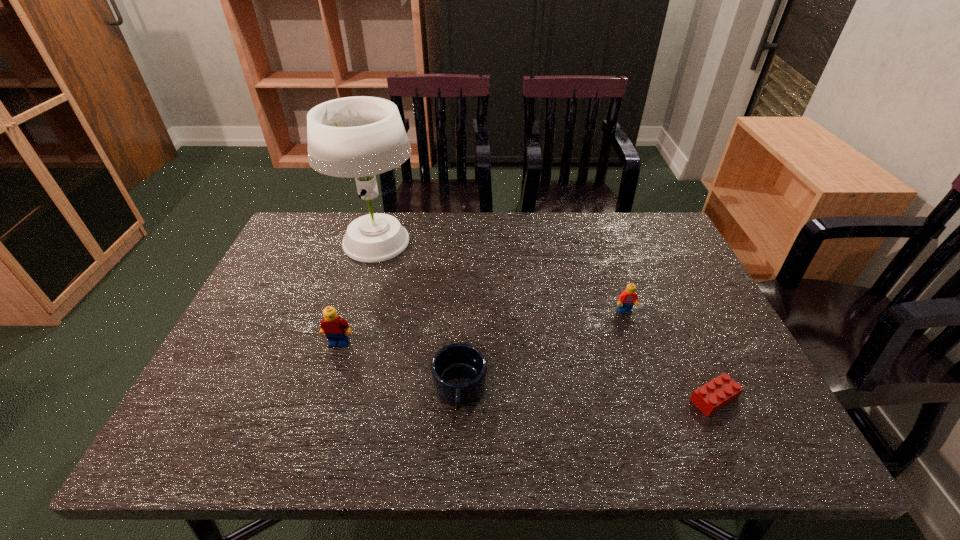
The image size is (960, 540). Find the location of `object present at the far left corner`. object present at the far left corner is located at coordinates (361, 136).

Where is `object present at the near right corner`? The height and width of the screenshot is (540, 960). object present at the near right corner is located at coordinates (719, 392).

Locate an element on the screen. The width and height of the screenshot is (960, 540). free point at the far edge is located at coordinates (490, 230).

Identify the location of vacant space at the near edge of the desktop. Image resolution: width=960 pixels, height=540 pixels. (534, 420).

Find the location of a particular element. vacant area at the left edge of the desktop is located at coordinates (x=262, y=366).

You are a GUI agent. You are given a task and a screenshot of the screen. Output one action in this format:
    pyautogui.click(x=<x>, y=<y>)
    Task: Click on the vacant region at the right edge
    
    Given the screenshot: What is the action you would take?
    pyautogui.click(x=638, y=278)

Locate an element on the screen. Image resolution: width=960 pixels, height=540 pixels. vacant space at the far right corner of the desktop is located at coordinates (639, 216).

Where is `vacant space that is in between the third object from left to right and the farthest object`? The width and height of the screenshot is (960, 540). vacant space that is in between the third object from left to right and the farthest object is located at coordinates (419, 316).

Identify the location of vacant area that lies between the fourth object from left to right and the third object from left to right. The height and width of the screenshot is (540, 960). (542, 350).

Locate an element on the screen. This screenshot has height=540, width=960. vacant area that lies between the third farthest object and the third object from right to left is located at coordinates (399, 366).